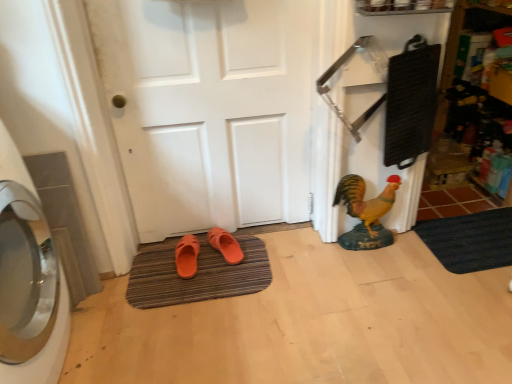
Where is `free location to the left of orange rubber slipper at lower center, positioned as the first footwear in left-to-right order`? Image resolution: width=512 pixels, height=384 pixels. free location to the left of orange rubber slipper at lower center, positioned as the first footwear in left-to-right order is located at coordinates (150, 267).